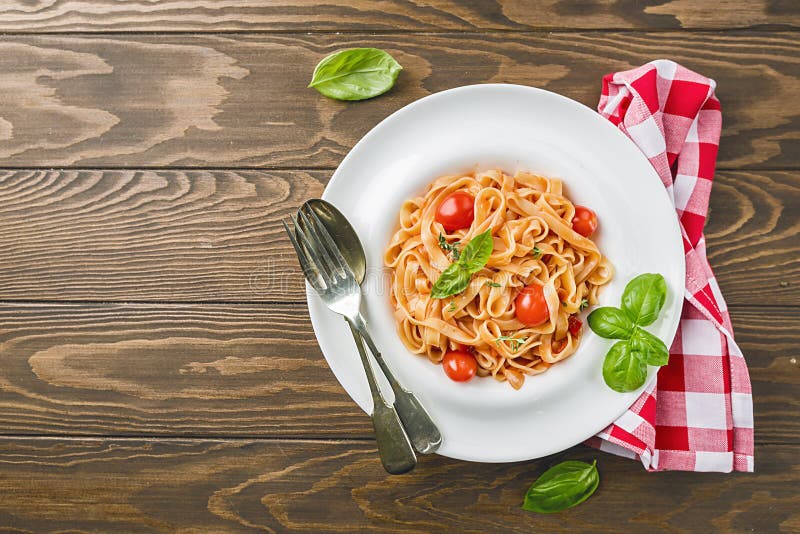
The image size is (800, 534). I want to click on dish, so click(x=586, y=141).